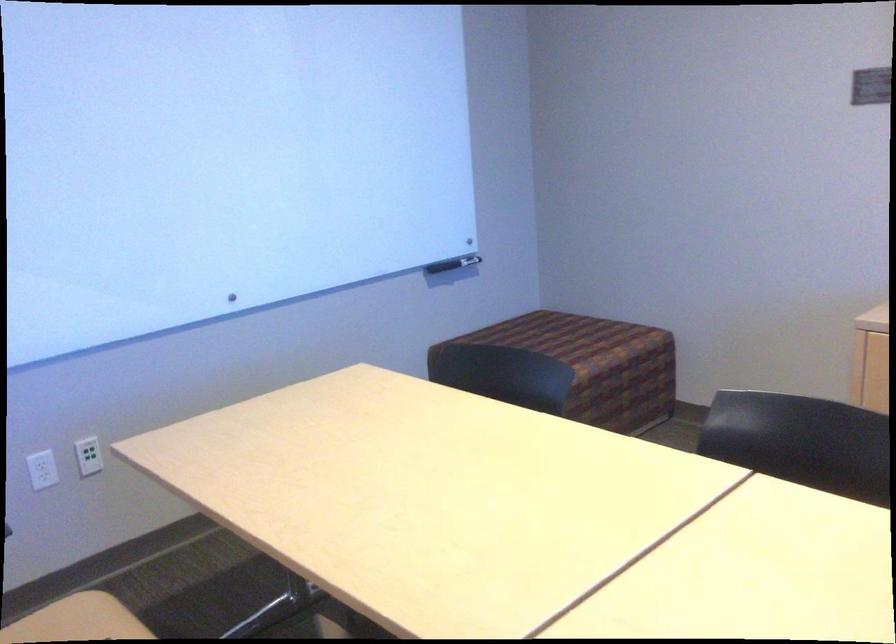
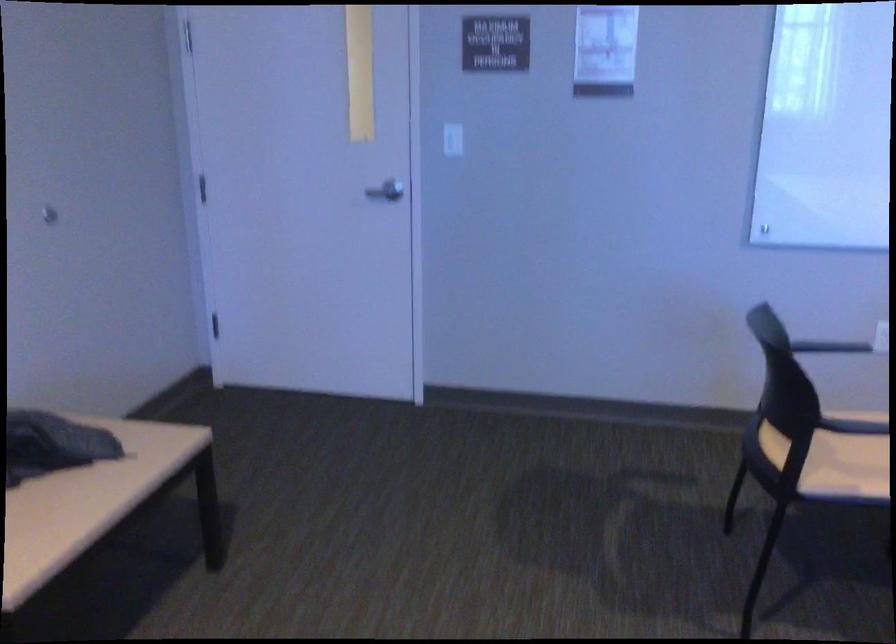
Question: The first image is from the beginning of the video and the second image is from the end. How did the camera likely rotate when shooting the video?

Choices:
 (A) Left
 (B) Right
 (C) Up
 (D) Down

Answer: (A)